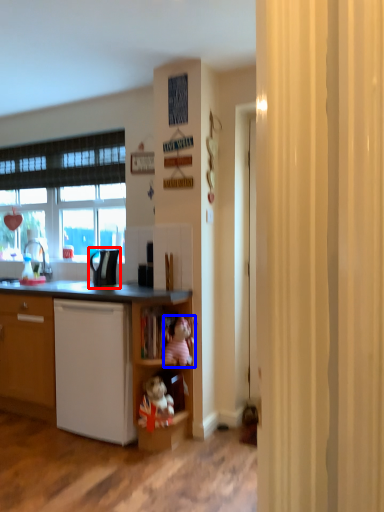
Question: Which object appears closest to the camera in this image, appliance (highlighted by a red box) or toy (highlighted by a blue box)?

Choices:
 (A) appliance
 (B) toy

Answer: (B)